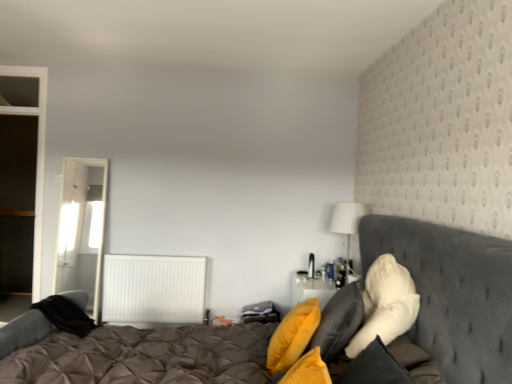
You are a GUI agent. You are given a task and a screenshot of the screen. Output one action in this format:
    pyautogui.click(x=<x>, y=<y>)
    Task: Click on the free spot above white textured radiator at center (from a real-world perspective)
    The height and width of the screenshot is (384, 512).
    Given the screenshot: What is the action you would take?
    click(x=160, y=257)